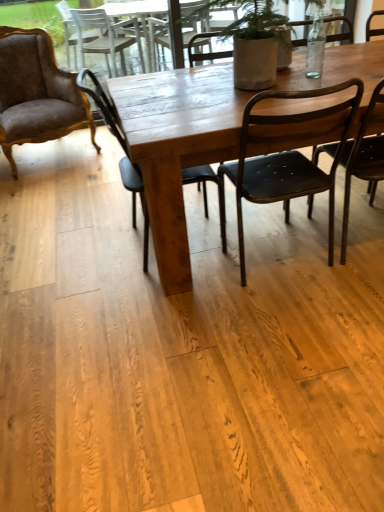
The height and width of the screenshot is (512, 384). Find the location of `vacant space to the left of black metal chair at center, the third chair in the left-to-right sequence`. vacant space to the left of black metal chair at center, the third chair in the left-to-right sequence is located at coordinates (190, 291).